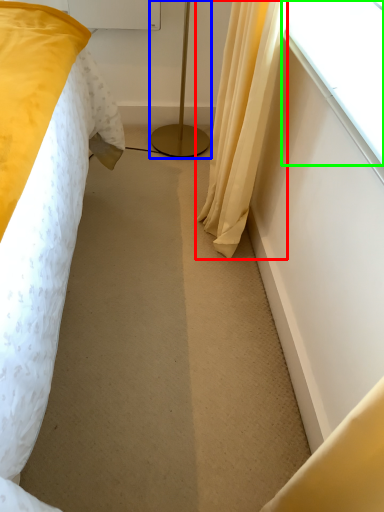
Question: Which object is positioned closest to curtain (highlighted by a red box)? Select from lamp (highlighted by a blue box) and window (highlighted by a green box).

Choices:
 (A) lamp
 (B) window

Answer: (B)